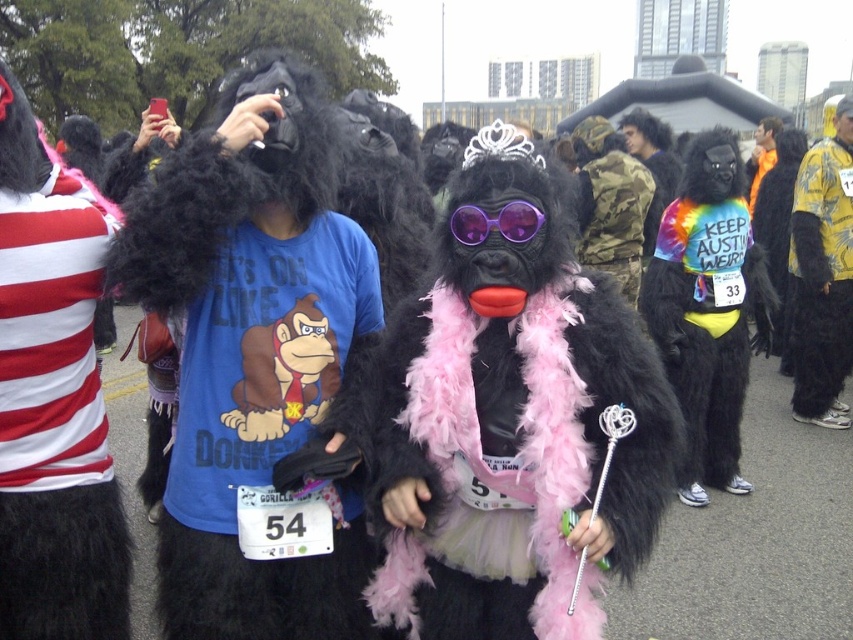
Question: Which of the following is the closest to the observer?

Choices:
 (A) purple plastic goggles at center
 (B) camo fabric uniform at center

Answer: (A)

Question: Is yellow printed shirt at right to the right of camo fabric uniform at center from the viewer's perspective?

Choices:
 (A) yes
 (B) no

Answer: (A)

Question: Is yellow printed shirt at right positioned behind purple plastic goggles at center?

Choices:
 (A) no
 (B) yes

Answer: (B)

Question: Which point is farther to the camera?

Choices:
 (A) camo fabric uniform at center
 (B) purple plastic goggles at center

Answer: (A)

Question: Is yellow printed shirt at right further to the viewer compared to camo fabric uniform at center?

Choices:
 (A) yes
 (B) no

Answer: (B)

Question: Which point is closer to the camera taking this photo?

Choices:
 (A) (596, 262)
 (B) (529, 234)
 (C) (828, 308)

Answer: (B)